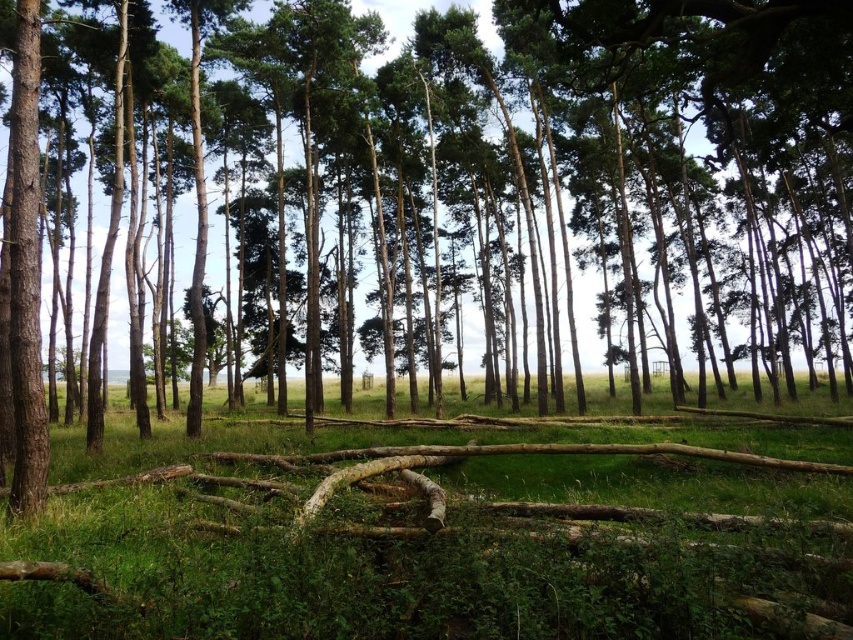
Question: Among these points, which one is farthest from the camera?

Choices:
 (A) (32, 220)
 (B) (489, 442)

Answer: (B)

Question: Can you confirm if green grassy at center is smaller than smooth brown tree trunk at left?

Choices:
 (A) no
 (B) yes

Answer: (A)

Question: Which point is closer to the camera?

Choices:
 (A) 33,280
 (B) 251,600

Answer: (B)

Question: Can you confirm if green grassy at center is positioned to the left of smooth brown tree trunk at left?

Choices:
 (A) no
 (B) yes

Answer: (A)

Question: Can you confirm if green grassy at center is bigger than smooth brown tree trunk at left?

Choices:
 (A) no
 (B) yes

Answer: (B)